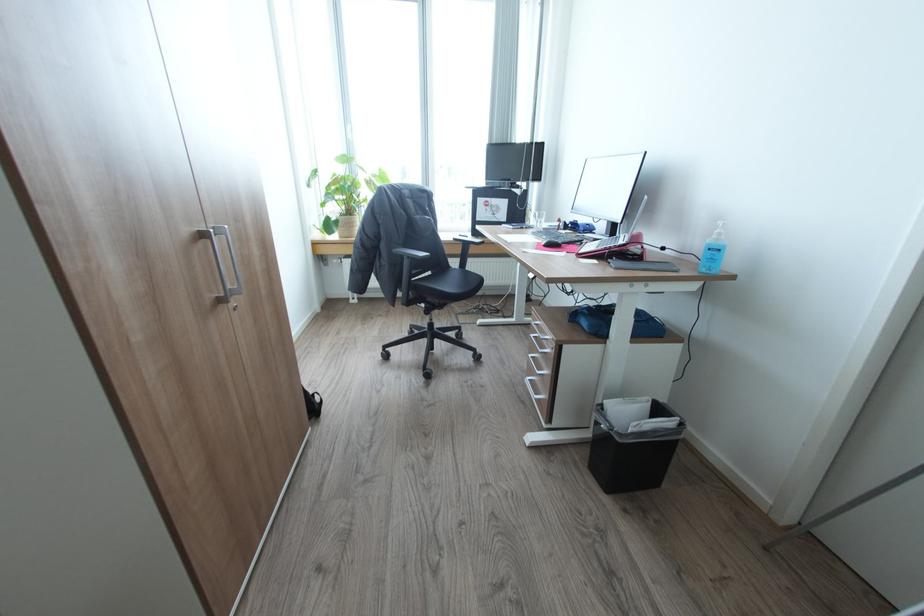
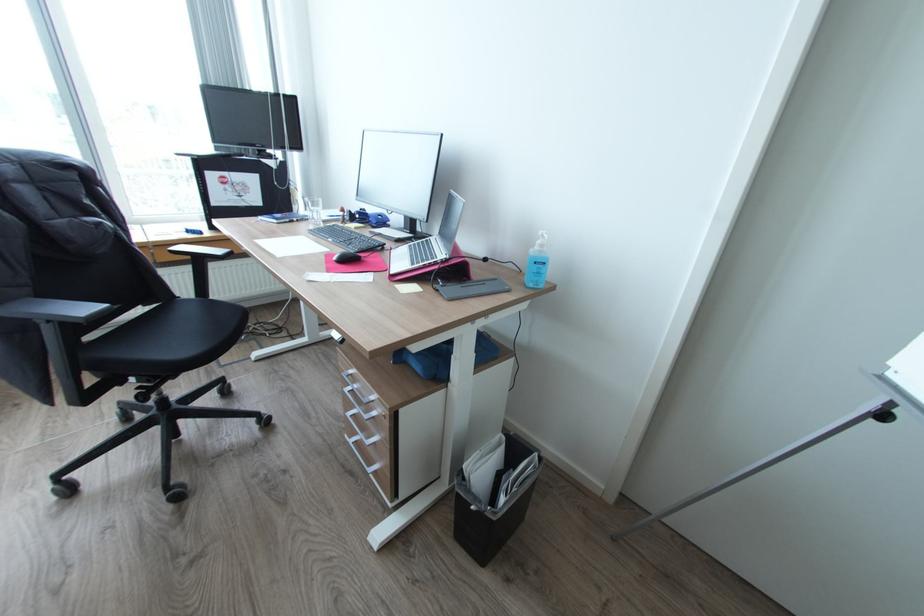
Locate, in the second image, the point that corresponds to the point at 541,392 in the first image.

(373, 464)